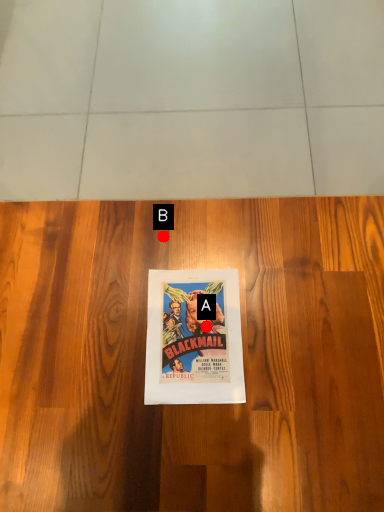
Question: Two points are circled on the image, labeled by A and B beside each circle. Which point appears closest to the camera in this image?

Choices:
 (A) A is closer
 (B) B is closer

Answer: (A)